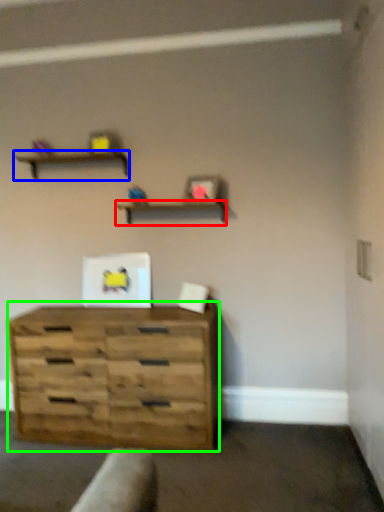
Question: Based on their relative distances, which object is nearer to shelf (highlighted by a red box)? Choose from shelf (highlighted by a blue box) and chest of drawers (highlighted by a green box).

Choices:
 (A) shelf
 (B) chest of drawers

Answer: (A)